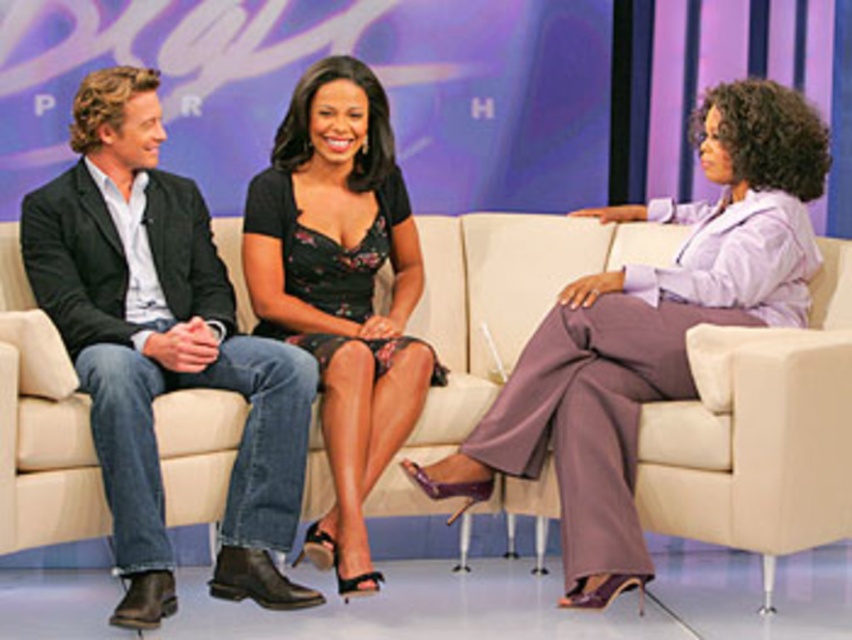
You are standing in front of the TV studio set. You need to place a 2.5 meter long banner between the denim jeans at left and yourself. Is there enough space?

The distance between the denim jeans at left and the viewer is 3.09 meters, so yes, the banner can be placed as it is shorter than the available space.

You are a camera operator trying to focus on two specific points in the scene. The first point is at coordinates point [111,497] and the second is at point [632,374]. Which point should you adjust your focus to first if you want to capture the closest one to the camera?

Point [111,497] is closer to the camera than point [632,374], so you should focus on point [111,497] first.

You are a photographer setting up for a group photo. You need to position yourself so that you can capture both the purple satin pants at right and the black floral dress at center in the same frame. Given that your camera has a maximum horizontal field of view of 30 inches, will you be able to fit both subjects into the frame?

The distance between the purple satin pants at right and the black floral dress at center is 31.65 inches. Since the camera can only capture 30 inches horizontally, the photographer will not be able to fit both subjects into the frame.